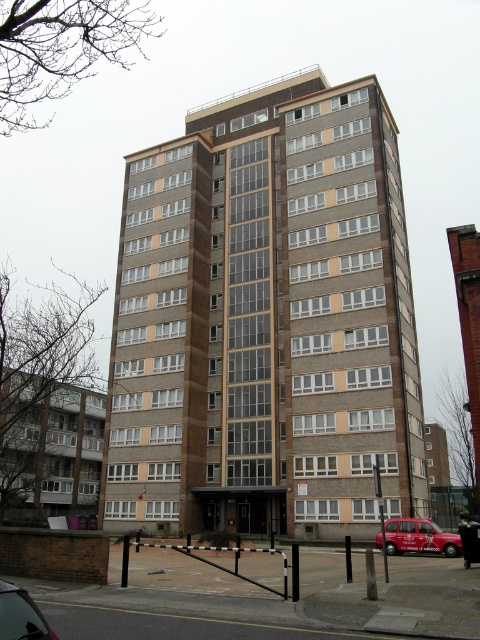
Question: Which point is farther to the camera?

Choices:
 (A) red matte taxi at lower right
 (B) metallic silver car at lower left

Answer: (A)

Question: Does red matte taxi at lower right lie in front of metallic silver car at lower left?

Choices:
 (A) yes
 (B) no

Answer: (B)

Question: Can you confirm if red matte taxi at lower right is bigger than metallic silver car at lower left?

Choices:
 (A) yes
 (B) no

Answer: (A)

Question: Can you confirm if red matte taxi at lower right is wider than metallic silver car at lower left?

Choices:
 (A) no
 (B) yes

Answer: (B)

Question: Among these points, which one is farthest from the camera?

Choices:
 (A) (412, 529)
 (B) (44, 625)

Answer: (A)